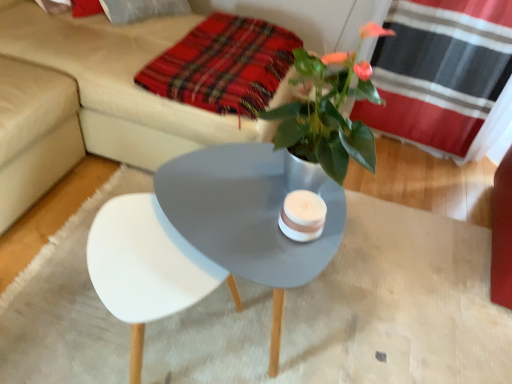
Question: Considering the relative sizes of plaid fabric at upper center and beige fabric couch at upper center in the image provided, is plaid fabric at upper center shorter than beige fabric couch at upper center?

Choices:
 (A) no
 (B) yes

Answer: (B)

Question: Could you tell me if plaid fabric at upper center is facing beige fabric couch at upper center?

Choices:
 (A) no
 (B) yes

Answer: (B)

Question: Does plaid fabric at upper center have a greater width compared to beige fabric couch at upper center?

Choices:
 (A) yes
 (B) no

Answer: (B)

Question: From a real-world perspective, is plaid fabric at upper center beneath beige fabric couch at upper center?

Choices:
 (A) yes
 (B) no

Answer: (B)

Question: Is plaid fabric at upper center further to camera compared to beige fabric couch at upper center?

Choices:
 (A) yes
 (B) no

Answer: (A)

Question: Considering the positions of point (202, 96) and point (342, 145), is point (202, 96) closer or farther from the camera than point (342, 145)?

Choices:
 (A) farther
 (B) closer

Answer: (A)

Question: From the image's perspective, is plaid fabric at upper center positioned above or below metallic silver plant at center?

Choices:
 (A) below
 (B) above

Answer: (B)

Question: In the image, is plaid fabric at upper center on the left side or the right side of metallic silver plant at center?

Choices:
 (A) left
 (B) right

Answer: (A)

Question: Based on their sizes in the image, would you say plaid fabric at upper center is bigger or smaller than metallic silver plant at center?

Choices:
 (A) small
 (B) big

Answer: (A)

Question: Would you say beige fabric couch at upper center is to the left or to the right of plaid fabric at upper center in the picture?

Choices:
 (A) right
 (B) left

Answer: (B)

Question: Is beige fabric couch at upper center inside the boundaries of plaid fabric at upper center, or outside?

Choices:
 (A) inside
 (B) outside

Answer: (B)

Question: In terms of height, does beige fabric couch at upper center look taller or shorter compared to plaid fabric at upper center?

Choices:
 (A) tall
 (B) short

Answer: (A)

Question: Considering the positions of beige fabric couch at upper center and plaid fabric at upper center in the image, is beige fabric couch at upper center wider or thinner than plaid fabric at upper center?

Choices:
 (A) wide
 (B) thin

Answer: (A)

Question: From the image's perspective, is metallic silver plant at center above or below beige fabric couch at upper center?

Choices:
 (A) above
 (B) below

Answer: (B)

Question: Looking at the image, does metallic silver plant at center seem bigger or smaller compared to beige fabric couch at upper center?

Choices:
 (A) small
 (B) big

Answer: (A)